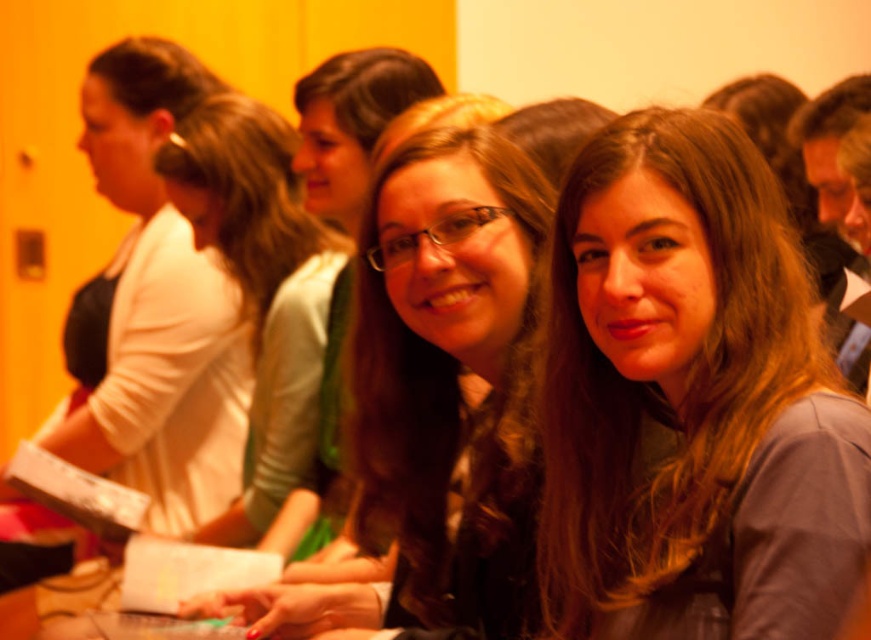
You are a photographer trying to capture a group photo where the brown hair at center and the matte black hair at center are both visible. Based on their sizes, which hair color will appear smaller in the final photo?

The brown hair at center will appear smaller in the final photo because it has a smaller size compared to the matte black hair at center.

You are a photographer setting up for a group photo in a classroom. You notice the matte black hair at center and the white matte jacket at upper left. Which object is positioned lower in the image?

The matte black hair at center is positioned below the white matte jacket at upper left, so the matte black hair at center is lower in the image.

You are a photographer who wants to ensure that both the brown hair at center and the white matte jacket at upper left are clearly visible in your photo. Given their sizes, which object should you focus on to capture both effectively?

Since the brown hair at center is smaller than the white matte jacket at upper left, you should focus on the white matte jacket at upper left to ensure both are visible, as it is larger and easier to capture.